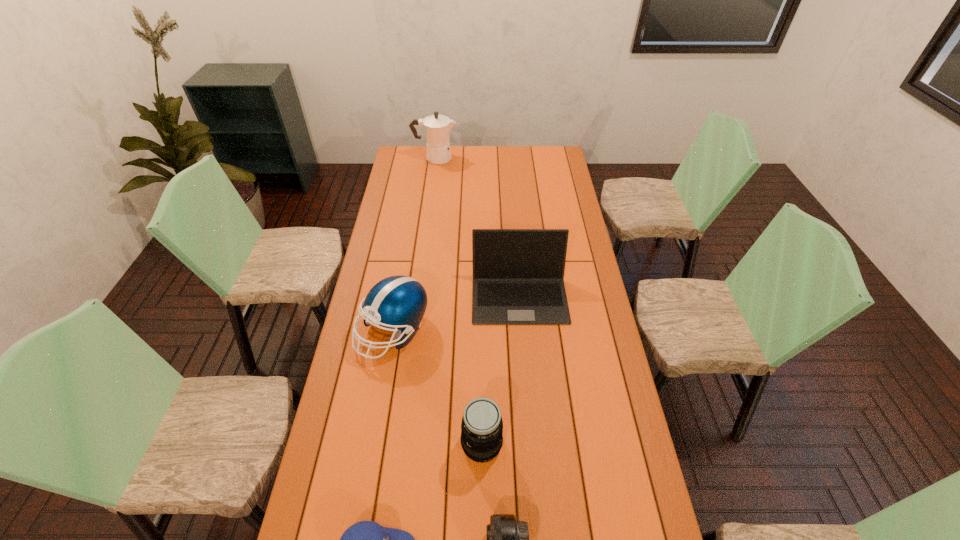
Where is `object situated at the far edge`? This screenshot has width=960, height=540. object situated at the far edge is located at coordinates (437, 128).

Find the location of a particular element. Image resolution: width=960 pixels, height=540 pixels. coffeepot located at the left edge is located at coordinates (437, 128).

The height and width of the screenshot is (540, 960). I want to click on football helmet situated at the left edge, so click(399, 302).

This screenshot has width=960, height=540. Identify the location of object that is at the right edge. (518, 274).

Locate an element on the screen. This screenshot has height=540, width=960. object at the far left corner is located at coordinates (437, 128).

This screenshot has height=540, width=960. I want to click on vacant space at the left edge of the desktop, so click(385, 399).

Where is `free space at the right edge of the desktop`? free space at the right edge of the desktop is located at coordinates (572, 259).

The width and height of the screenshot is (960, 540). What are the coordinates of `vacant area that lies between the taller telephoto lens and the football helmet` in the screenshot? It's located at (438, 387).

Where is `free space that is in between the football helmet and the farther telephoto lens`? The width and height of the screenshot is (960, 540). free space that is in between the football helmet and the farther telephoto lens is located at coordinates (x=438, y=387).

Image resolution: width=960 pixels, height=540 pixels. Find the location of `object that stands as the third closest to the farthest object`. object that stands as the third closest to the farthest object is located at coordinates (481, 438).